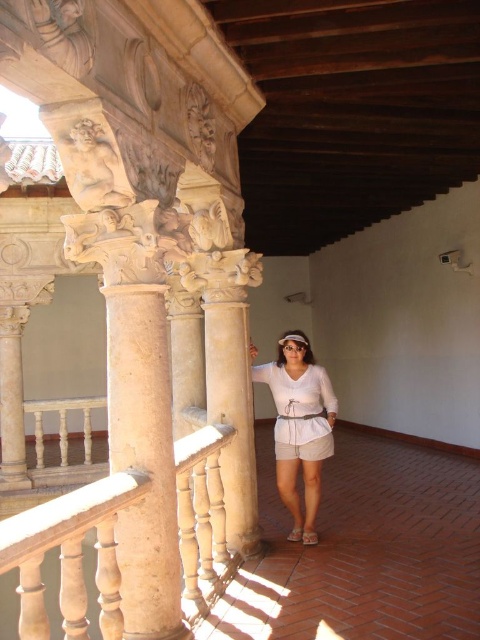
Question: Is white cotton dress at center above light brown leather sandal at lower center?

Choices:
 (A) yes
 (B) no

Answer: (A)

Question: Which object is the closest to the beige stone column at center?

Choices:
 (A) beige polished wood railing at upper left
 (B) white cotton shorts at center

Answer: (A)

Question: Does beige polished wood railing at upper left appear on the left side of white cotton shorts at center?

Choices:
 (A) yes
 (B) no

Answer: (A)

Question: Which object appears farthest from the camera in this image?

Choices:
 (A) white fabric sandal at lower center
 (B) white cotton shorts at center

Answer: (A)

Question: Is white cotton shorts at center smaller than light brown leather sandal at lower center?

Choices:
 (A) yes
 (B) no

Answer: (B)

Question: Which object appears farthest from the camera in this image?

Choices:
 (A) white marble column at center
 (B) beige polished wood railing at upper left
 (C) beige stone column at center

Answer: (A)